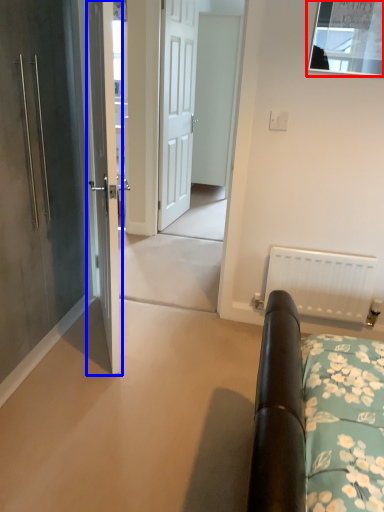
Question: Which of the following is the farthest to the observer, window (highlighted by a red box) or door (highlighted by a blue box)?

Choices:
 (A) window
 (B) door

Answer: (A)